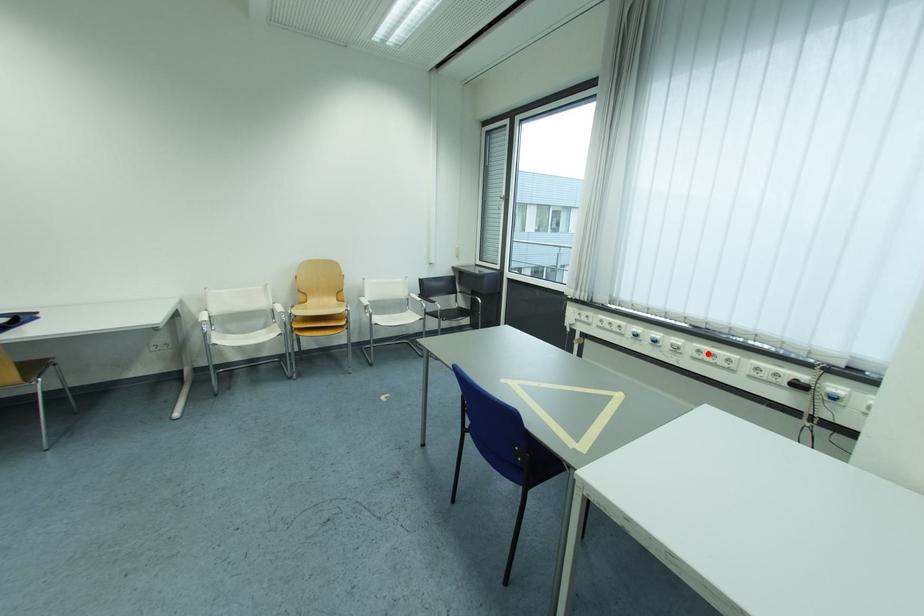
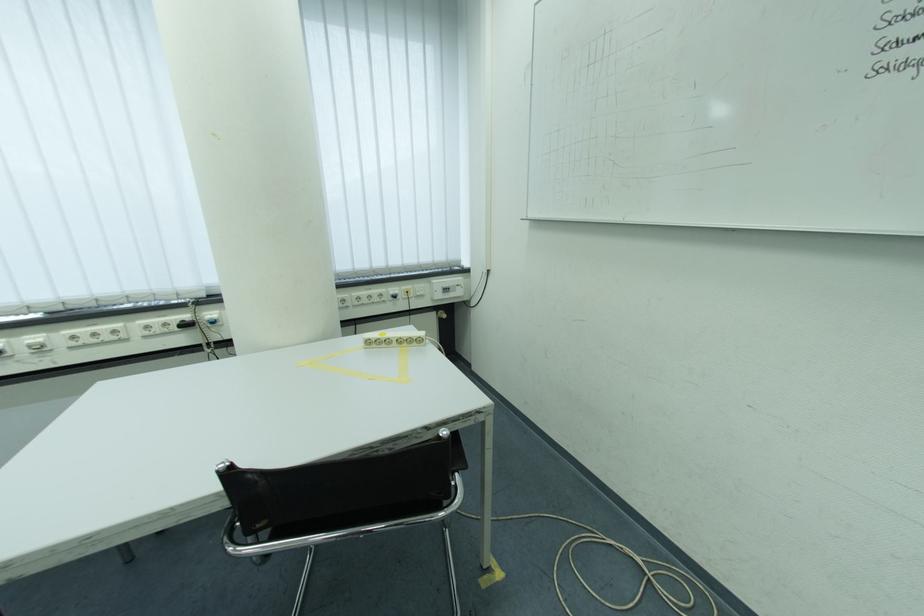
Find the pixel in the second image that matches the highlighted location in the first image.

(82, 339)